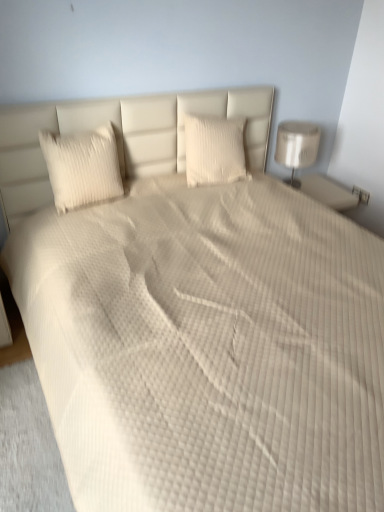
Where is `white textured pillow at center, which ranks as the 2th pillow in left-to-right order`? Image resolution: width=384 pixels, height=512 pixels. white textured pillow at center, which ranks as the 2th pillow in left-to-right order is located at coordinates (214, 150).

Is white textured pillow at left, acting as the first pillow starting from the left, looking in the opposite direction of white glossy lamp at right?

No, white textured pillow at left, acting as the first pillow starting from the left,'s orientation is not away from white glossy lamp at right.

Does white textured pillow at left, marked as the 2th pillow in a right-to-left arrangement, have a lesser height compared to white glossy lamp at right?

Indeed, white textured pillow at left, marked as the 2th pillow in a right-to-left arrangement, has a lesser height compared to white glossy lamp at right.

Could you measure the distance between white textured pillow at left, acting as the first pillow starting from the left, and white glossy lamp at right?

white textured pillow at left, acting as the first pillow starting from the left, is 3.86 feet from white glossy lamp at right.

In terms of width, does white textured pillow at left, marked as the 2th pillow in a right-to-left arrangement, look wider or thinner when compared to white glossy lamp at right?

Clearly, white textured pillow at left, marked as the 2th pillow in a right-to-left arrangement, has less width compared to white glossy lamp at right.

Where is `the 2nd pillow positioned below the white glossy lamp at right (from the image's perspective)`? The width and height of the screenshot is (384, 512). the 2nd pillow positioned below the white glossy lamp at right (from the image's perspective) is located at coordinates (82, 167).

Could you tell me if white glossy lamp at right is turned towards white textured pillow at left, acting as the first pillow starting from the left?

No, white glossy lamp at right is not aimed at white textured pillow at left, acting as the first pillow starting from the left.

Is white glossy lamp at right closer to camera compared to white textured pillow at left, marked as the 2th pillow in a right-to-left arrangement?

No, white glossy lamp at right is further to the viewer.

How many degrees apart are the facing directions of white textured pillow at left, marked as the 2th pillow in a right-to-left arrangement, and white textured pillow at center, arranged as the first pillow when viewed from the right?

There is a 2.75-degree angle between the facing directions of white textured pillow at left, marked as the 2th pillow in a right-to-left arrangement, and white textured pillow at center, arranged as the first pillow when viewed from the right.

Does white textured pillow at left, acting as the first pillow starting from the left, have a greater width compared to white textured pillow at center, which ranks as the 2th pillow in left-to-right order?

Indeed, white textured pillow at left, acting as the first pillow starting from the left, has a greater width compared to white textured pillow at center, which ranks as the 2th pillow in left-to-right order.

Based on the photo, would you say white textured pillow at left, marked as the 2th pillow in a right-to-left arrangement, is a long distance from white textured pillow at center, which ranks as the 2th pillow in left-to-right order?

No, white textured pillow at left, marked as the 2th pillow in a right-to-left arrangement, is in close proximity to white textured pillow at center, which ranks as the 2th pillow in left-to-right order.

Considering their positions, is white textured pillow at left, marked as the 2th pillow in a right-to-left arrangement, located in front of or behind white textured pillow at center, arranged as the first pillow when viewed from the right?

white textured pillow at left, marked as the 2th pillow in a right-to-left arrangement, is in front of white textured pillow at center, arranged as the first pillow when viewed from the right.

Is white textured pillow at center, which ranks as the 2th pillow in left-to-right order, facing towards white glossy lamp at right?

No, white textured pillow at center, which ranks as the 2th pillow in left-to-right order, is not facing towards white glossy lamp at right.

Does white textured pillow at center, arranged as the first pillow when viewed from the right, have a greater height compared to white glossy lamp at right?

In fact, white textured pillow at center, arranged as the first pillow when viewed from the right, may be shorter than white glossy lamp at right.

Is point (213, 154) closer or farther from the camera than point (303, 122)?

Point (213, 154).

Does white glossy lamp at right have a larger size compared to white textured pillow at center, which ranks as the 2th pillow in left-to-right order?

Correct, white glossy lamp at right is larger in size than white textured pillow at center, which ranks as the 2th pillow in left-to-right order.

Is white glossy lamp at right looking in the opposite direction of white textured pillow at center, which ranks as the 2th pillow in left-to-right order?

white glossy lamp at right does not have its back to white textured pillow at center, which ranks as the 2th pillow in left-to-right order.

Do you think white glossy lamp at right is within white textured pillow at center, which ranks as the 2th pillow in left-to-right order, or outside of it?

white glossy lamp at right is not enclosed by white textured pillow at center, which ranks as the 2th pillow in left-to-right order.

Who is more distant, white textured pillow at center, arranged as the first pillow when viewed from the right, or white textured pillow at left, marked as the 2th pillow in a right-to-left arrangement?

white textured pillow at center, arranged as the first pillow when viewed from the right, is behind.

Is white textured pillow at center, arranged as the first pillow when viewed from the right, not close to white textured pillow at left, marked as the 2th pillow in a right-to-left arrangement?

No.

Is point (201, 118) positioned after point (71, 207)?

Yes, point (201, 118) is behind point (71, 207).

From the image's perspective, starting from the white glossy lamp at right, which pillow is the 2nd one below? Please provide its 2D coordinates.

[(82, 167)]

Image resolution: width=384 pixels, height=512 pixels. What are the coordinates of `lamp to the right of white textured pillow at left, acting as the first pillow starting from the left` in the screenshot? It's located at coord(297,146).

Looking at the image, which one is located further to white glossy lamp at right, white textured pillow at center, which ranks as the 2th pillow in left-to-right order, or white textured pillow at left, acting as the first pillow starting from the left?

Based on the image, white textured pillow at left, acting as the first pillow starting from the left, appears to be further to white glossy lamp at right.

Which object lies further to the anchor point white textured pillow at left, acting as the first pillow starting from the left, white textured pillow at center, which ranks as the 2th pillow in left-to-right order, or white glossy lamp at right?

white glossy lamp at right.

Estimate the real-world distances between objects in this image. Which object is further from white glossy lamp at right, white textured pillow at left, acting as the first pillow starting from the left, or white textured pillow at center, which ranks as the 2th pillow in left-to-right order?

Among the two, white textured pillow at left, acting as the first pillow starting from the left, is located further to white glossy lamp at right.

Based on their spatial positions, is white glossy lamp at right or white textured pillow at center, arranged as the first pillow when viewed from the right, further from white textured pillow at left, marked as the 2th pillow in a right-to-left arrangement?

Among the two, white glossy lamp at right is located further to white textured pillow at left, marked as the 2th pillow in a right-to-left arrangement.

Estimate the real-world distances between objects in this image. Which object is further from white textured pillow at center, which ranks as the 2th pillow in left-to-right order, white glossy lamp at right or white textured pillow at left, marked as the 2th pillow in a right-to-left arrangement?

Based on the image, white textured pillow at left, marked as the 2th pillow in a right-to-left arrangement, appears to be further to white textured pillow at center, which ranks as the 2th pillow in left-to-right order.

Based on their spatial positions, is white textured pillow at left, acting as the first pillow starting from the left, or white glossy lamp at right further from white textured pillow at center, which ranks as the 2th pillow in left-to-right order?

Among the two, white textured pillow at left, acting as the first pillow starting from the left, is located further to white textured pillow at center, which ranks as the 2th pillow in left-to-right order.

Locate an element on the screen. Image resolution: width=384 pixels, height=512 pixels. pillow located between white textured pillow at left, marked as the 2th pillow in a right-to-left arrangement, and white glossy lamp at right in the left-right direction is located at coordinates (214, 150).